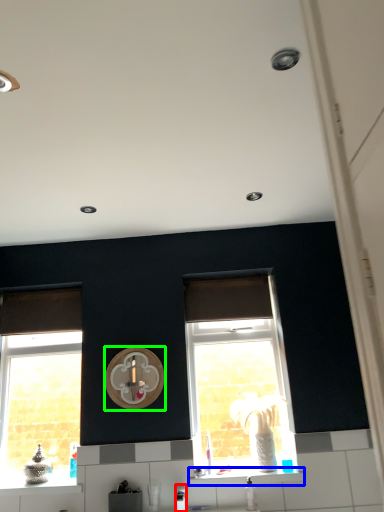
Question: Estimate the real-world distances between objects in this image. Which object is farther from appliance (highlighted by a red box), window sill (highlighted by a blue box) or clock (highlighted by a green box)?

Choices:
 (A) window sill
 (B) clock

Answer: (B)